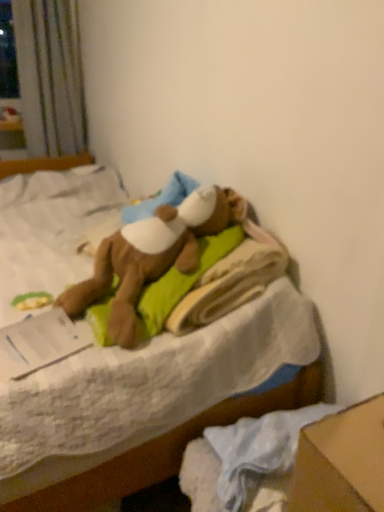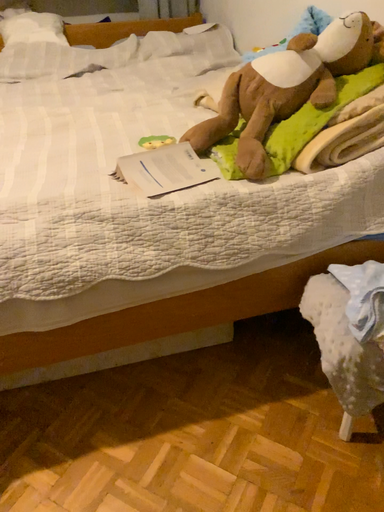
Question: Which way did the camera rotate in the video?

Choices:
 (A) rotated right
 (B) rotated left

Answer: (B)